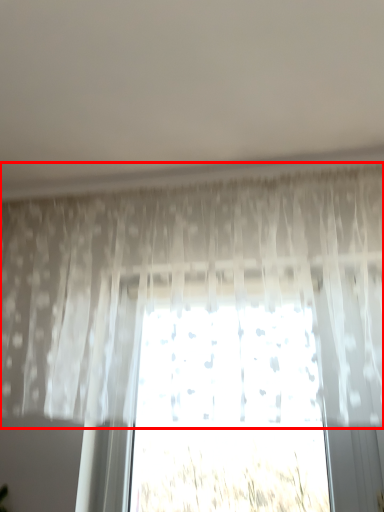
Question: Considering the relative positions of curtain (annotated by the red box) and plant in the image provided, where is curtain (annotated by the red box) located with respect to the staircase?

Choices:
 (A) right
 (B) left

Answer: (B)